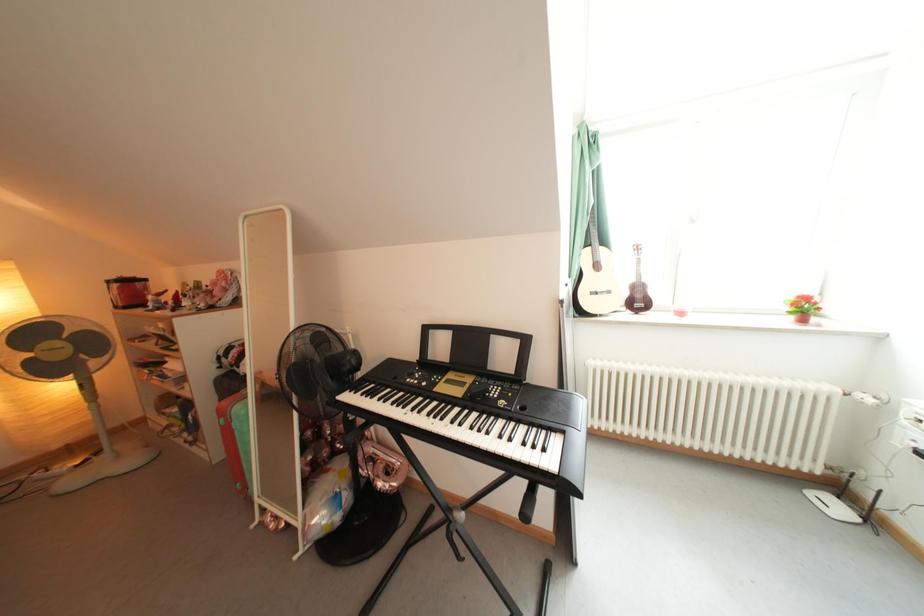
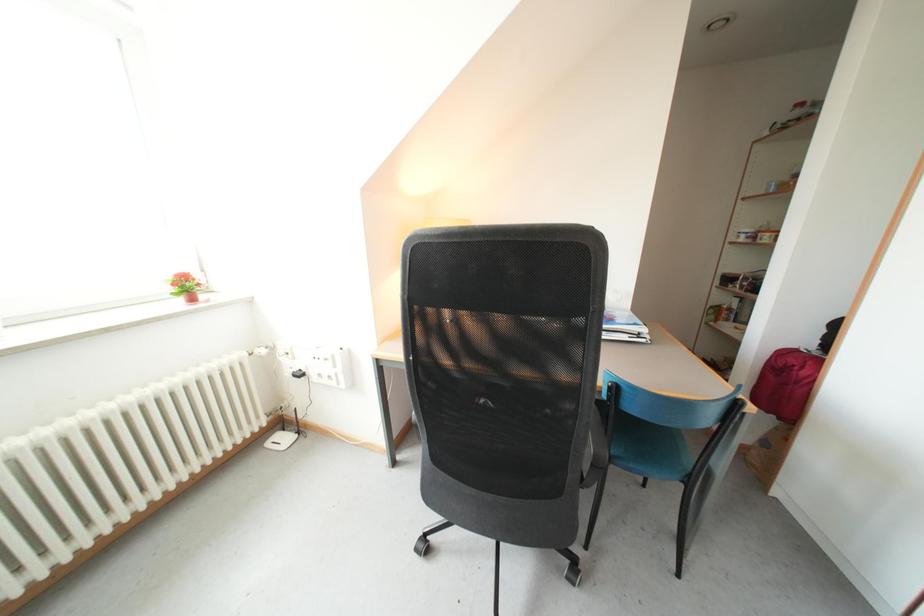
The images are taken continuously from a first-person perspective. In which direction is your viewpoint rotating?

The camera rotated toward right-down.